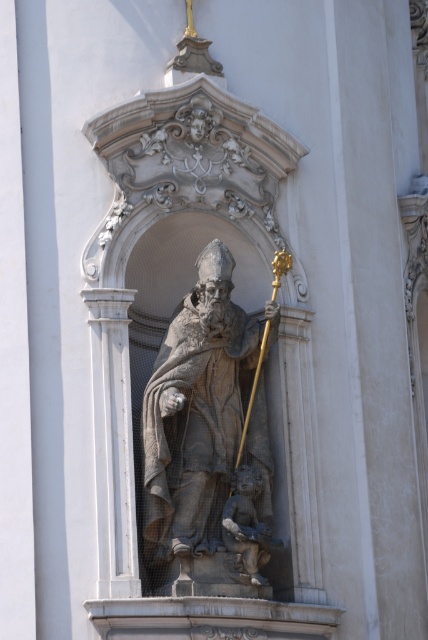
Does gray stone statue at center have a lesser height compared to smooth stone cherub at lower center?

Incorrect, gray stone statue at center's height does not fall short of smooth stone cherub at lower center's.

At what (x,y) coordinates should I click in order to perform the action: click on gray stone statue at center. Please return your answer as a coordinate pair (x, y). Looking at the image, I should click on [208, 442].